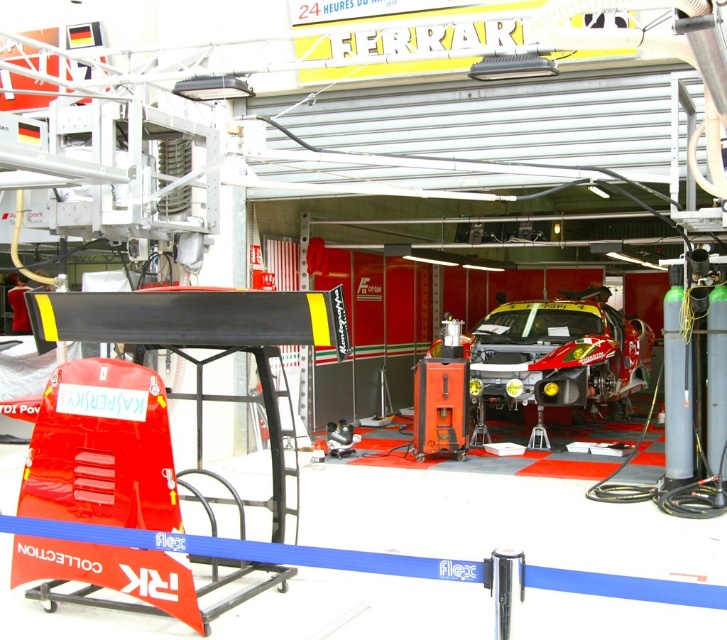
Does shiny silver car at center appear under metallic silver mechanic at center?

Indeed, shiny silver car at center is positioned under metallic silver mechanic at center.

Which is above, shiny silver car at center or metallic silver mechanic at center?

Positioned higher is metallic silver mechanic at center.

Which is behind, point (566, 348) or point (12, 288)?

The point (12, 288) is behind.

Where is `shiny silver car at center`? This screenshot has height=640, width=727. shiny silver car at center is located at coordinates (558, 356).